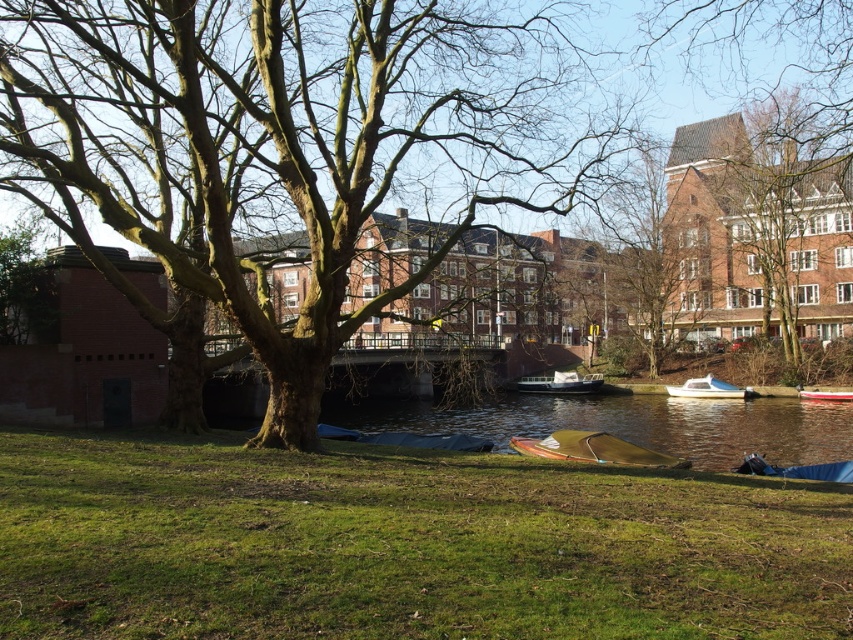
Does white glossy boat at center lie in front of red plastic boat at lower right?

No, it is not.

Who is more distant from viewer, (x=548, y=385) or (x=798, y=388)?

The point (x=548, y=385) is more distant.

Is point (572, 384) farther from viewer compared to point (815, 397)?

Yes, point (572, 384) is behind point (815, 397).

Where is `white glossy boat at center`? white glossy boat at center is located at coordinates (561, 384).

Looking at this image, is green grass at lower center shorter than red plastic boat at lower right?

No, green grass at lower center is not shorter than red plastic boat at lower right.

Is the position of green grass at lower center more distant than that of red plastic boat at lower right?

That is False.

Is point (265, 492) positioned before point (820, 396)?

Yes.

Where is `green grass at lower center`? This screenshot has height=640, width=853. green grass at lower center is located at coordinates (403, 545).

Is brown rough tree at upper center shorter than wooden canoe at center?

No.

Between point (805, 216) and point (631, 444), which one is positioned in front?

Point (631, 444) is in front.

Which is in front, point (764, 154) or point (619, 444)?

Positioned in front is point (619, 444).

At what (x,y) coordinates should I click in order to perform the action: click on brown rough tree at upper center. Please return your answer as a coordinate pair (x, y). Image resolution: width=853 pixels, height=640 pixels. Looking at the image, I should click on (782, 218).